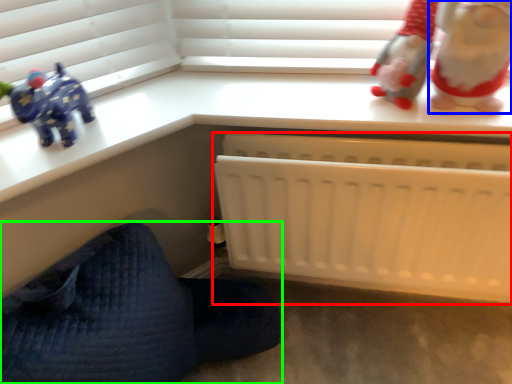
Question: Which is farther away from infant bed (highlighted by a red box)? toy (highlighted by a blue box) or furniture (highlighted by a green box)?

Choices:
 (A) toy
 (B) furniture

Answer: (B)